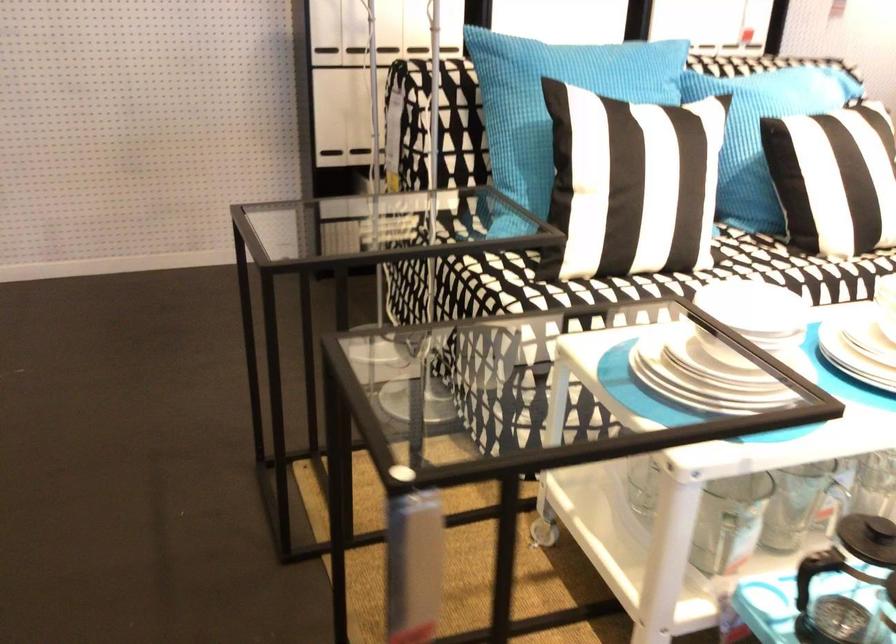
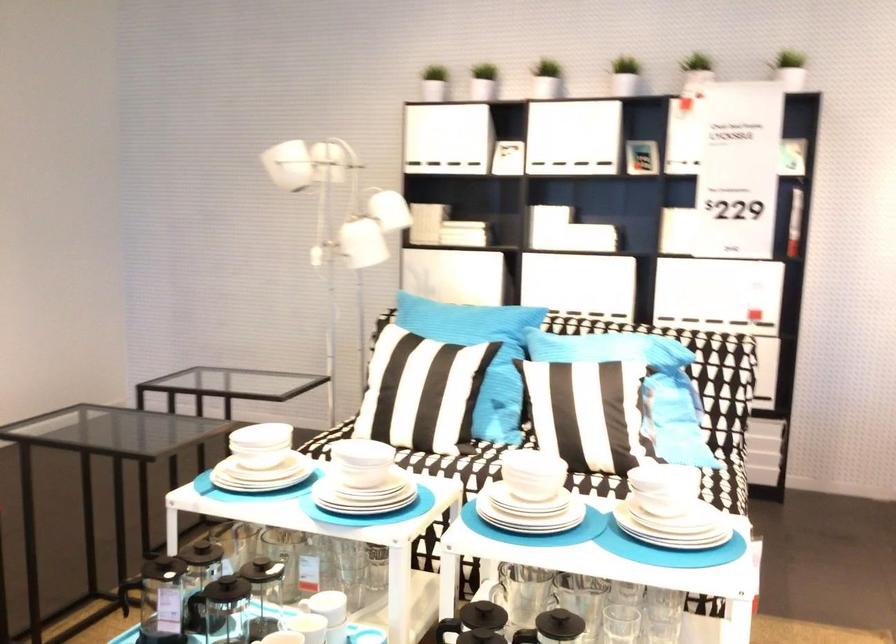
Question: I am providing you with two images of the same scene from different viewpoints. Please identify which objects are invisible in image2.

Choices:
 (A) white ceramic bowl
 (B) white board
 (C) sofa sitting surface
 (D) teal blue pillow

Answer: (A)